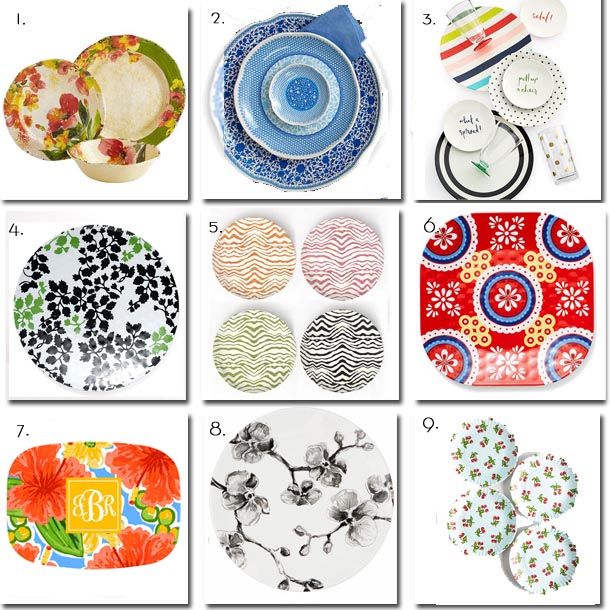
Locate an element on the screen. Image resolution: width=610 pixels, height=610 pixels. light blue bowl is located at coordinates point(332,137).